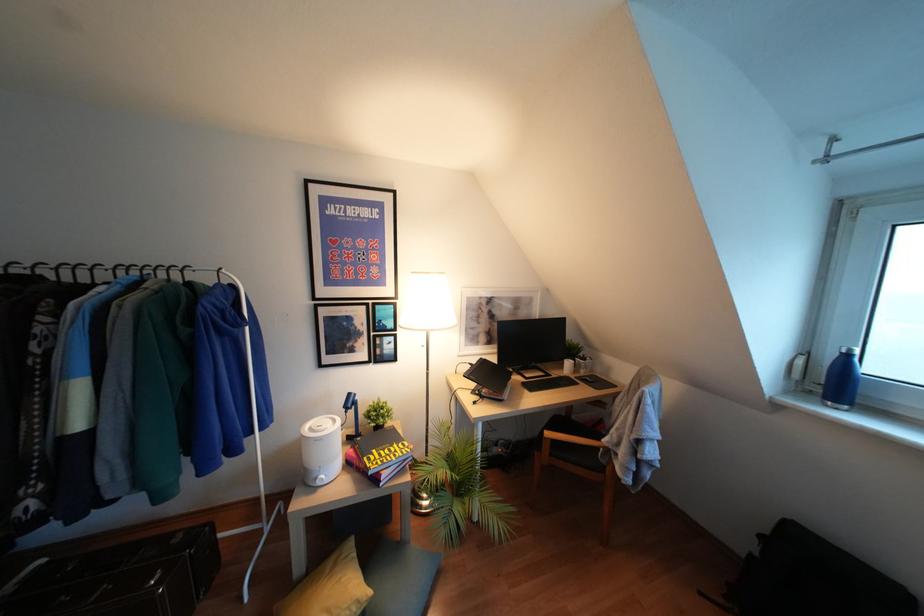
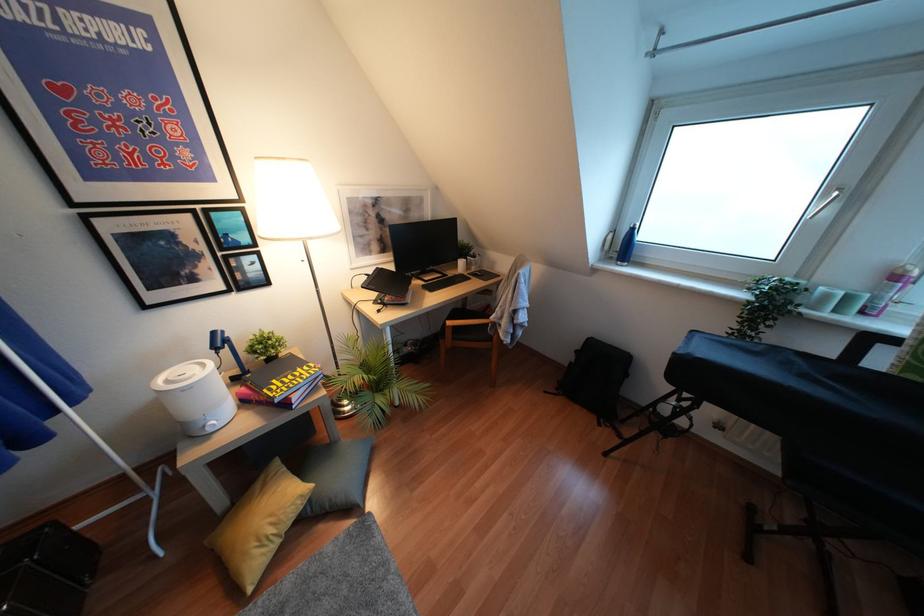
Find the pixel in the second image that matches (x=833, y=379) in the first image.

(623, 246)